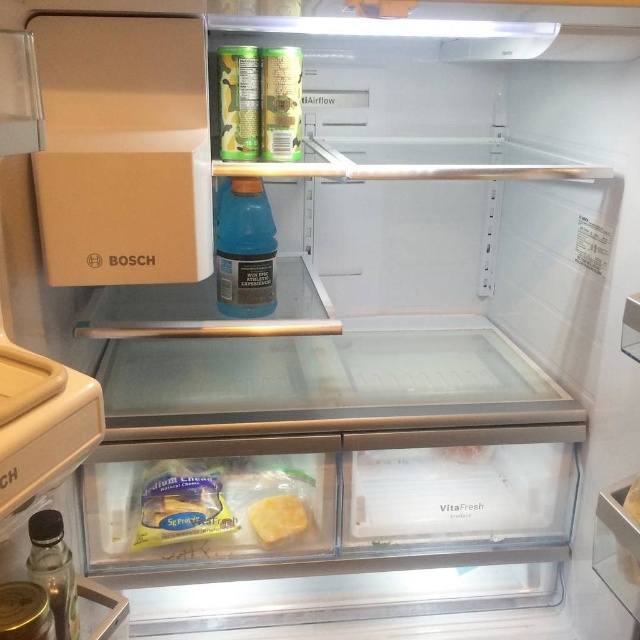
Question: Can you confirm if yellow plastic cheese at lower center is positioned to the right of translucent glass bottle at lower left?

Choices:
 (A) yes
 (B) no

Answer: (A)

Question: Is blue translucent bottle at center further to the viewer compared to translucent glass bottle at lower left?

Choices:
 (A) yes
 (B) no

Answer: (A)

Question: Which point is farther to the camera?

Choices:
 (A) yellow cheese at lower center
 (B) translucent glass bottle at lower left
 (C) blue translucent bottle at center
 (D) yellow plastic cheese at lower center

Answer: (A)

Question: Which object is positioned farthest from the yellow cheese at lower center?

Choices:
 (A) blue translucent bottle at center
 (B) yellow plastic cheese at lower center
 (C) translucent glass bottle at lower left

Answer: (C)

Question: Can you confirm if blue translucent bottle at center is thinner than translucent glass bottle at lower left?

Choices:
 (A) no
 (B) yes

Answer: (A)

Question: Which object is positioned farthest from the blue translucent bottle at center?

Choices:
 (A) yellow plastic cheese at lower center
 (B) translucent glass bottle at lower left

Answer: (B)